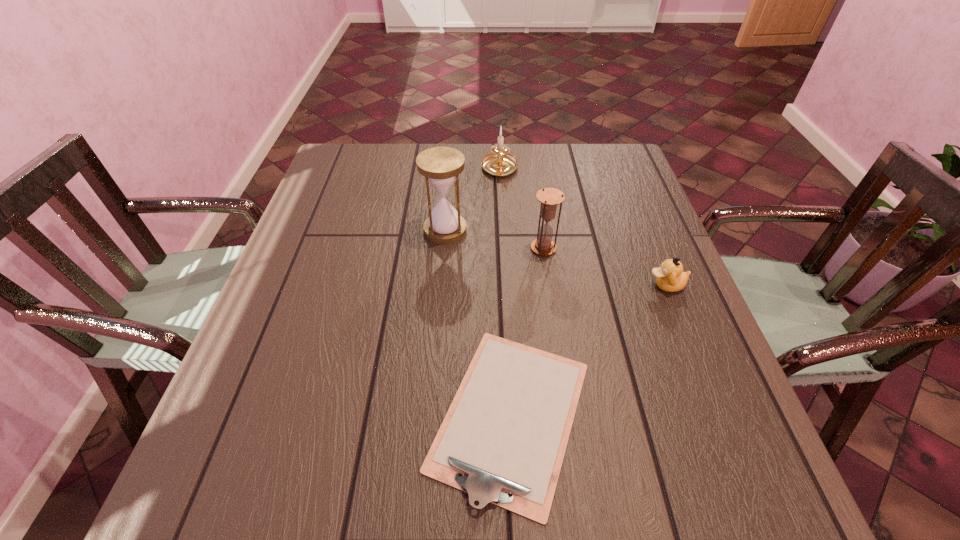
I want to click on free space located 0.110m on the back of the taller hourglass, so click(x=448, y=193).

Identify the location of free space located 0.060m on the front of the right hourglass. This screenshot has height=540, width=960. (547, 275).

Where is `vacant region located 0.160m on the handle side of the farthest object`? This screenshot has height=540, width=960. vacant region located 0.160m on the handle side of the farthest object is located at coordinates (502, 218).

Image resolution: width=960 pixels, height=540 pixels. Identify the location of vacant space located on the face of the duckling. (524, 285).

This screenshot has width=960, height=540. In order to click on free location located on the face of the duckling in this screenshot , I will do pos(599,285).

Identify the location of blank space located 0.150m on the face of the duckling. (581, 285).

The height and width of the screenshot is (540, 960). Identify the location of free region located on the right of the nearest object. (659, 415).

Locate an element on the screen. object located in the far edge section of the desktop is located at coordinates (x=499, y=163).

At what (x,y) coordinates should I click in order to perform the action: click on object at the near edge. Please return your answer as a coordinate pair (x, y). Looking at the image, I should click on (503, 439).

At what (x,y) coordinates should I click in order to perform the action: click on object that is at the right edge. Please return your answer as a coordinate pair (x, y). The height and width of the screenshot is (540, 960). Looking at the image, I should click on (670, 277).